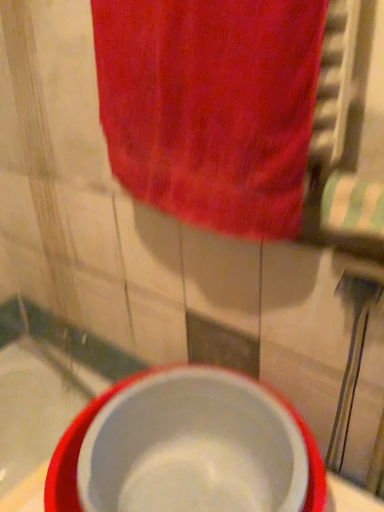
Question: Is white plastic basin at center thinner than red cotton towel at upper center?

Choices:
 (A) no
 (B) yes

Answer: (A)

Question: Can you confirm if white plastic basin at center is positioned to the left of red cotton towel at upper center?

Choices:
 (A) yes
 (B) no

Answer: (A)

Question: Is white plastic basin at center located outside red cotton towel at upper center?

Choices:
 (A) yes
 (B) no

Answer: (A)

Question: Is white plastic basin at center surrounding red cotton towel at upper center?

Choices:
 (A) no
 (B) yes

Answer: (A)

Question: Does white plastic basin at center come behind red cotton towel at upper center?

Choices:
 (A) yes
 (B) no

Answer: (A)

Question: Can you confirm if white plastic basin at center is wider than red cotton towel at upper center?

Choices:
 (A) yes
 (B) no

Answer: (A)

Question: From a real-world perspective, does white glossy bath at lower left sit lower than red cotton towel at upper center?

Choices:
 (A) no
 (B) yes

Answer: (B)

Question: Is white glossy bath at lower left not near red cotton towel at upper center?

Choices:
 (A) yes
 (B) no

Answer: (B)

Question: Is white glossy bath at lower left at the left side of red cotton towel at upper center?

Choices:
 (A) no
 (B) yes

Answer: (B)

Question: Does white glossy bath at lower left come behind red cotton towel at upper center?

Choices:
 (A) no
 (B) yes

Answer: (B)

Question: Is white glossy bath at lower left shorter than red cotton towel at upper center?

Choices:
 (A) yes
 (B) no

Answer: (A)

Question: Is white glossy bath at lower left bigger than red cotton towel at upper center?

Choices:
 (A) no
 (B) yes

Answer: (B)

Question: Is white plastic basin at center aimed at white glossy bath at lower left?

Choices:
 (A) yes
 (B) no

Answer: (B)